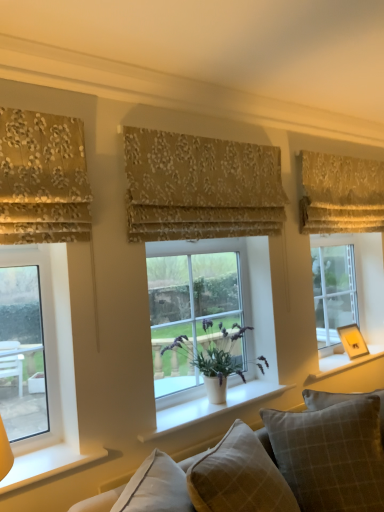
The height and width of the screenshot is (512, 384). I want to click on blank space above clear glass window at left, which is the third window from back to front (from a real-world perspective), so click(16, 245).